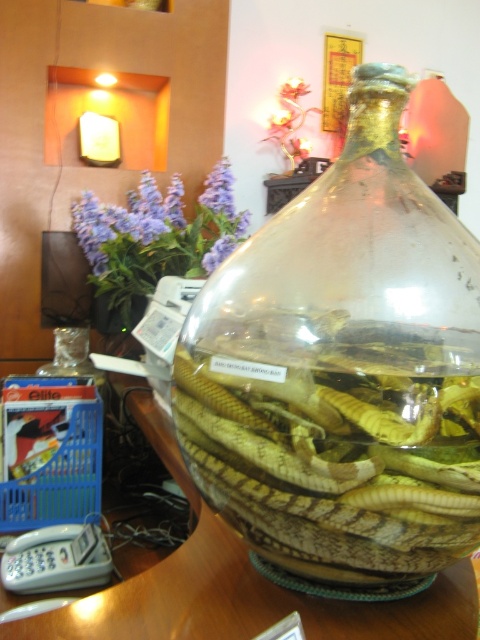
Can you confirm if transparent glass jar at center is wider than wooden table at center?

No, transparent glass jar at center is not wider than wooden table at center.

Measure the distance between point (432,195) and camera.

A distance of 22.49 inches exists between point (432,195) and camera.

You are a GUI agent. You are given a task and a screenshot of the screen. Output one action in this format:
    pyautogui.click(x=<x>, y=<y>)
    Task: Click on the transparent glass jar at center
    The width and height of the screenshot is (480, 640).
    Given the screenshot: What is the action you would take?
    pyautogui.click(x=343, y=369)